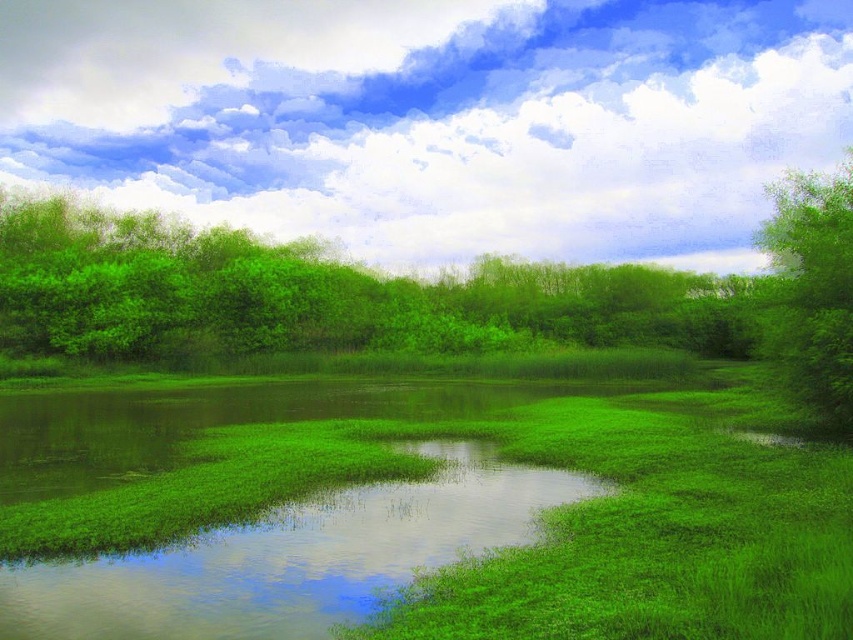
Question: Which object appears farthest from the camera in this image?

Choices:
 (A) green leafy tree at right
 (B) green leafy trees at upper center

Answer: (B)

Question: Estimate the real-world distances between objects in this image. Which object is closer to the green leafy trees at upper center?

Choices:
 (A) green grassy water at center
 (B) green leafy tree at right

Answer: (B)

Question: Can you confirm if green grassy water at center is positioned to the right of green leafy tree at right?

Choices:
 (A) yes
 (B) no

Answer: (B)

Question: Is green grassy water at center thinner than green leafy tree at right?

Choices:
 (A) no
 (B) yes

Answer: (B)

Question: Estimate the real-world distances between objects in this image. Which object is closer to the green grassy water at center?

Choices:
 (A) green leafy tree at right
 (B) green leafy trees at upper center

Answer: (A)

Question: Is green leafy trees at upper center wider than green leafy tree at right?

Choices:
 (A) yes
 (B) no

Answer: (A)